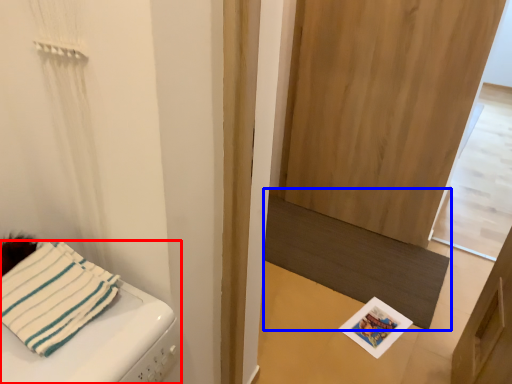
Question: Among these objects, which one is farthest to the camera, furniture (highlighted by a red box) or mat (highlighted by a blue box)?

Choices:
 (A) furniture
 (B) mat

Answer: (B)